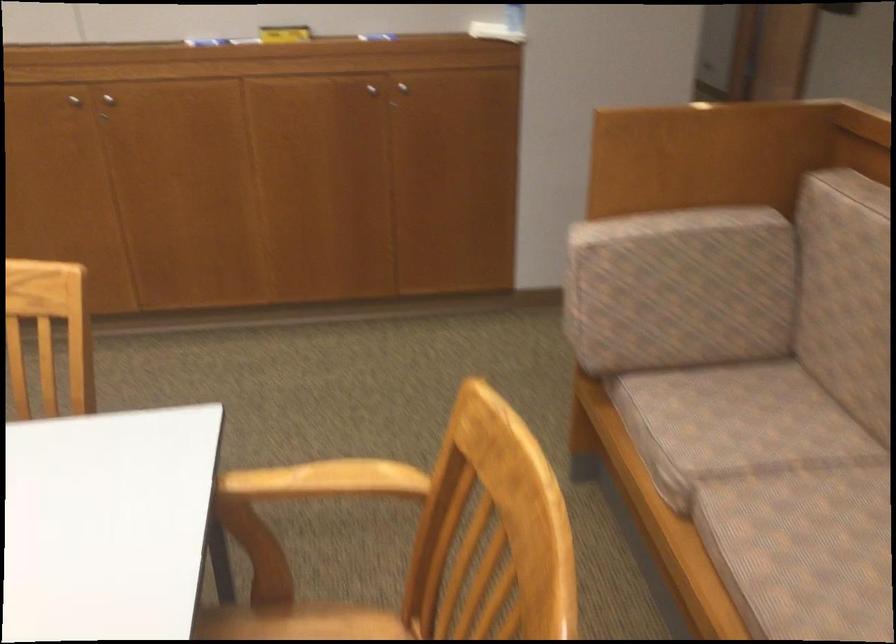
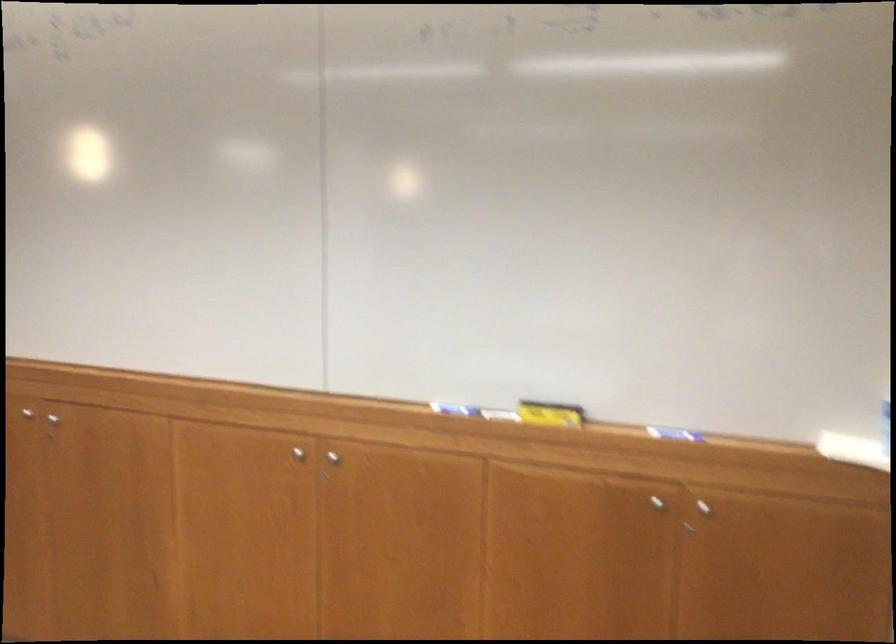
In the second image, find the point that corresponds to [113,98] in the first image.

(332, 457)